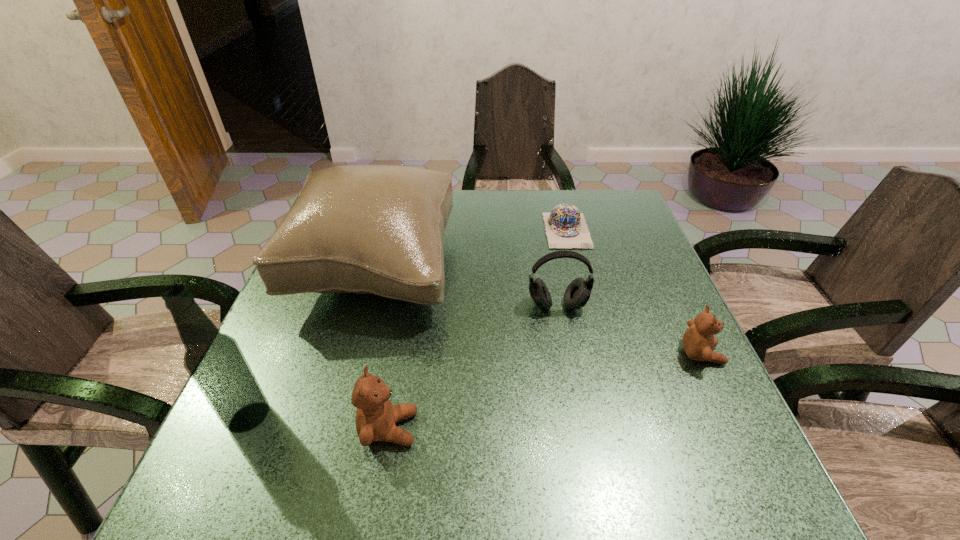
Find the location of a particular element. The width and height of the screenshot is (960, 540). the closest object to the cap is located at coordinates (578, 292).